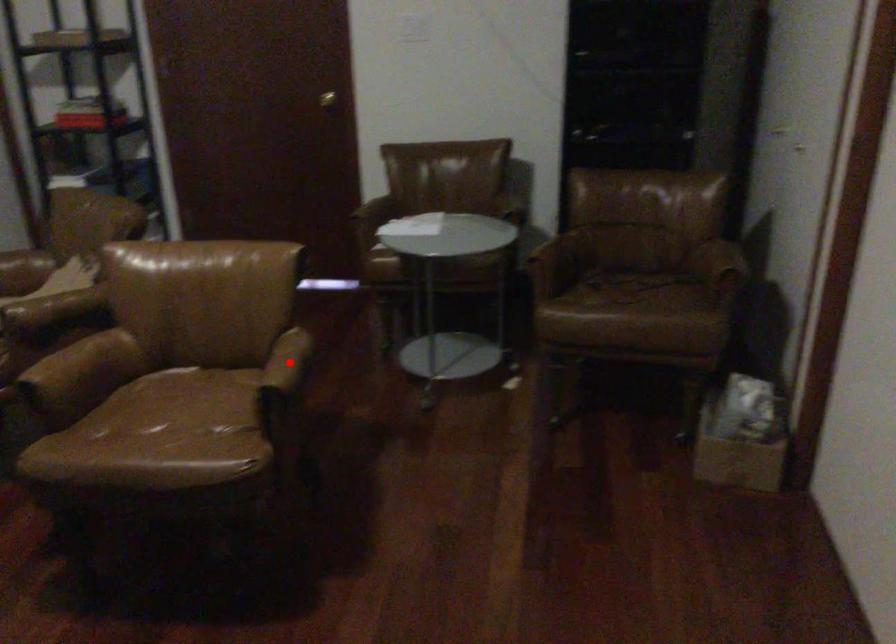
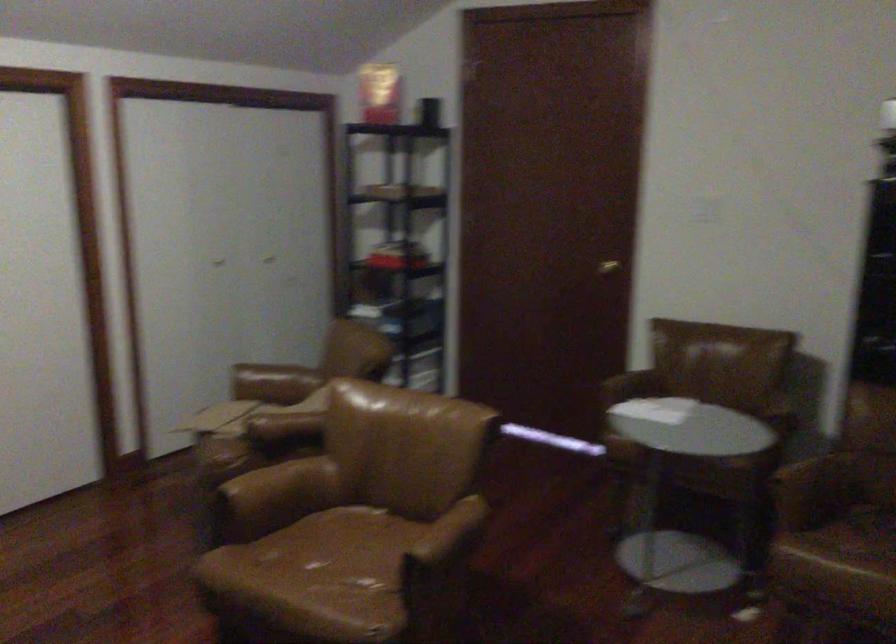
Where in the second image is the point corresponding to the highlighted location from the first image?

(448, 536)